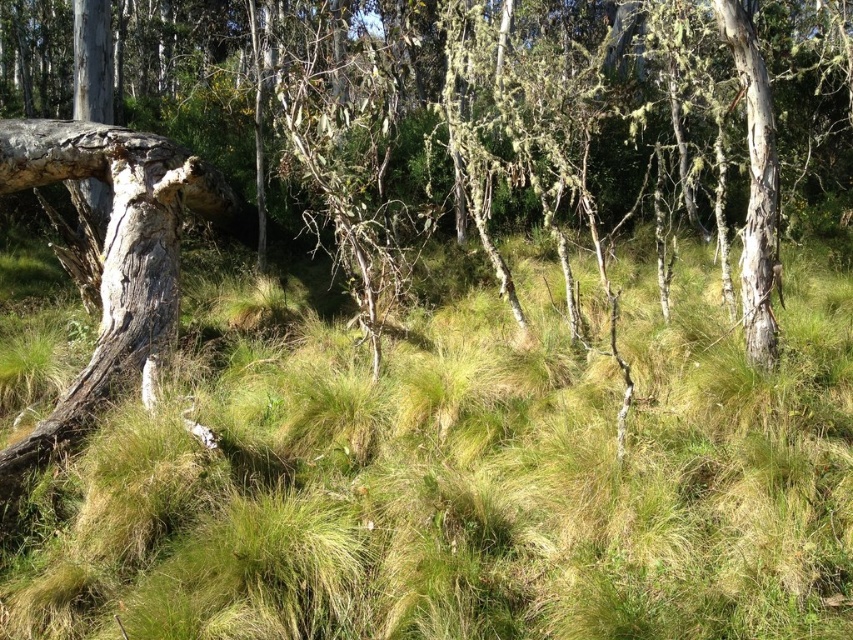
Question: Among these objects, which one is farthest from the camera?

Choices:
 (A) smooth bark tree trunk at right
 (B) green grassy at center

Answer: (A)

Question: Which point is closer to the camera taking this photo?

Choices:
 (A) (782, 632)
 (B) (746, 67)

Answer: (A)

Question: Does green grassy at center appear under smooth bark tree trunk at right?

Choices:
 (A) no
 (B) yes

Answer: (B)

Question: Where is green grassy at center located in relation to smooth bark tree trunk at right in the image?

Choices:
 (A) above
 (B) below

Answer: (B)

Question: Does green grassy at center appear on the right side of smooth bark tree trunk at right?

Choices:
 (A) no
 (B) yes

Answer: (A)